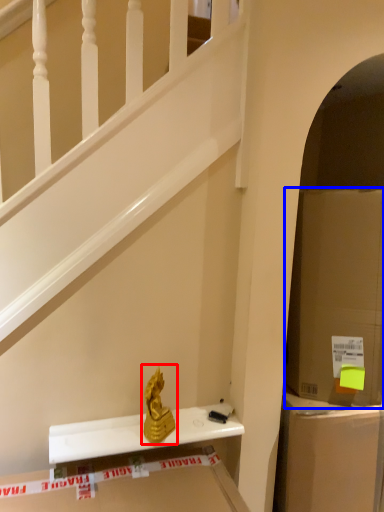
Question: Which of the following is the farthest to the observer, sculpture (highlighted by a red box) or cardboard box (highlighted by a blue box)?

Choices:
 (A) sculpture
 (B) cardboard box

Answer: (A)